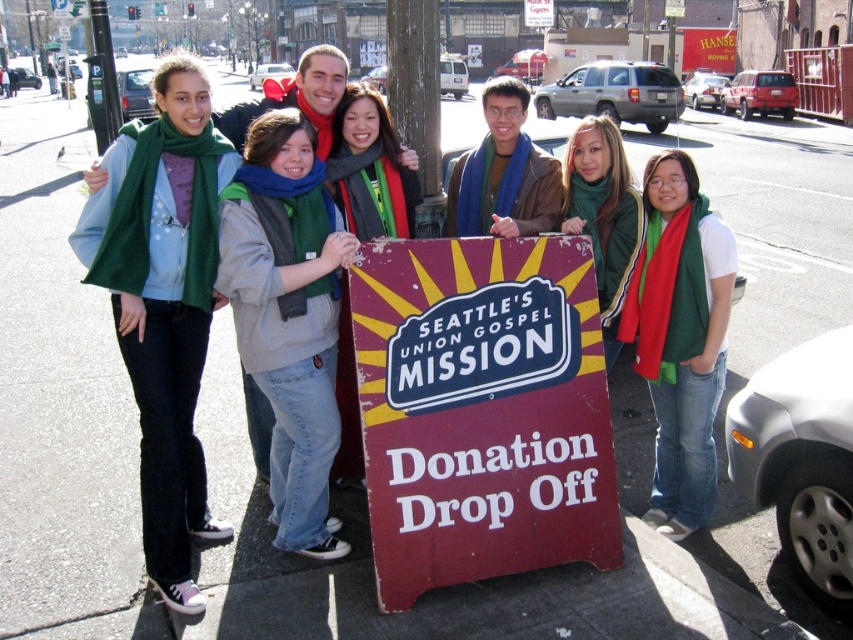
Based on the scene description and the coordinates provided, can you identify which object corresponds to the point at coordinates (480,410)?

The rusty metal sign at center corresponds to the point at coordinates (480,410).

You are a photographer trying to capture a clear shot of the blue scarf at center. However, the rusty metal sign at center is blocking your view. Can you move the sign to the side to get a better angle?

The rusty metal sign at center is in front of the blue scarf at center, so moving the sign to the side would allow you to see the blue scarf at center without obstruction.